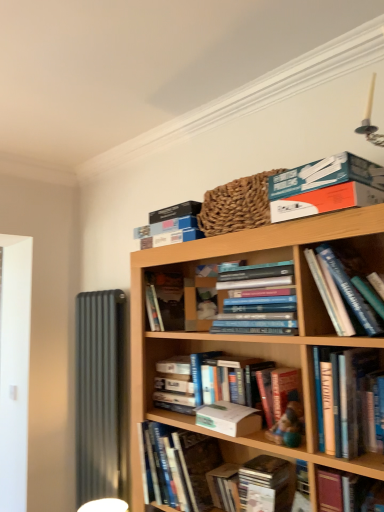
Question: Can you confirm if hardcover book at center, which ranks as the 6th book in top-to-bottom order, is positioned to the left of wooden cd case at lower center, the first book when ordered from bottom to top?

Choices:
 (A) yes
 (B) no

Answer: (B)

Question: Would you say hardcover book at center, which ranks as the 6th book in top-to-bottom order, is outside wooden cd case at lower center, marked as the ninth book in a top-to-bottom arrangement?

Choices:
 (A) no
 (B) yes

Answer: (B)

Question: Does hardcover book at center, which ranks as the 6th book in top-to-bottom order, have a lesser height compared to wooden cd case at lower center, marked as the ninth book in a top-to-bottom arrangement?

Choices:
 (A) no
 (B) yes

Answer: (A)

Question: Is hardcover book at center, which ranks as the 6th book in top-to-bottom order, bigger than wooden cd case at lower center, the first book when ordered from bottom to top?

Choices:
 (A) no
 (B) yes

Answer: (B)

Question: Considering the relative sizes of hardcover book at center, which ranks as the 6th book in top-to-bottom order, and wooden cd case at lower center, marked as the ninth book in a top-to-bottom arrangement, in the image provided, is hardcover book at center, which ranks as the 6th book in top-to-bottom order, taller than wooden cd case at lower center, marked as the ninth book in a top-to-bottom arrangement,?

Choices:
 (A) no
 (B) yes

Answer: (B)

Question: In the image, is hardcover book at center, which is counted as the 4th book, starting from the bottom, on the left side or the right side of white paper at center, arranged as the first paperback book when ordered from the bottom?

Choices:
 (A) right
 (B) left

Answer: (A)

Question: Looking at the image, does hardcover book at center, which ranks as the 6th book in top-to-bottom order, seem bigger or smaller compared to white paper at center, arranged as the first paperback book when ordered from the bottom?

Choices:
 (A) small
 (B) big

Answer: (B)

Question: Considering the positions of hardcover book at center, which is counted as the 4th book, starting from the bottom, and white paper at center, which is counted as the 2th paperback book, starting from the top, in the image, is hardcover book at center, which is counted as the 4th book, starting from the bottom, taller or shorter than white paper at center, which is counted as the 2th paperback book, starting from the top,?

Choices:
 (A) short
 (B) tall

Answer: (B)

Question: Is hardcover book at center, which is counted as the 4th book, starting from the bottom, inside or outside of white paper at center, the second paperback book positioned from the back?

Choices:
 (A) outside
 (B) inside

Answer: (A)

Question: From the image's perspective, is white paper at center, the second paperback book positioned from the back, above or below hardcover books at center, the 6th book from the bottom?

Choices:
 (A) above
 (B) below

Answer: (B)

Question: Is white paper at center, positioned as the 1th paperback book in front-to-back order, inside or outside of hardcover books at center, the fourth book from the top?

Choices:
 (A) outside
 (B) inside

Answer: (A)

Question: Is point (208, 411) closer or farther from the camera than point (233, 326)?

Choices:
 (A) farther
 (B) closer

Answer: (A)

Question: Considering the positions of white paper at center, arranged as the first paperback book when ordered from the bottom, and hardcover books at center, the 6th book from the bottom, in the image, is white paper at center, arranged as the first paperback book when ordered from the bottom, wider or thinner than hardcover books at center, the 6th book from the bottom,?

Choices:
 (A) wide
 (B) thin

Answer: (B)

Question: In terms of width, does wooden cd case at lower center, marked as the ninth book in a top-to-bottom arrangement, look wider or thinner when compared to blue cardboard box at upper center, which ranks as the 1th book in top-to-bottom order?

Choices:
 (A) thin
 (B) wide

Answer: (A)

Question: Is wooden cd case at lower center, marked as the ninth book in a top-to-bottom arrangement, inside or outside of blue cardboard box at upper center, the ninth book from the bottom?

Choices:
 (A) outside
 (B) inside

Answer: (A)